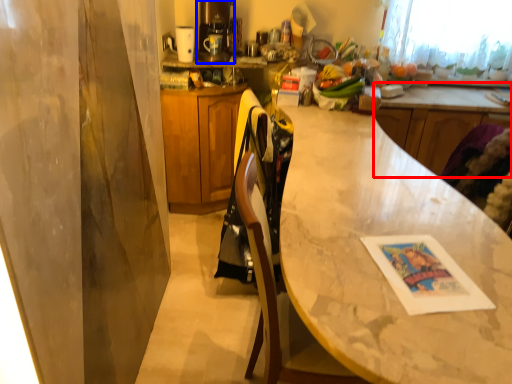
Question: Which of the following is the farthest to the observer, counter (highlighted by a red box) or coffee machine (highlighted by a blue box)?

Choices:
 (A) counter
 (B) coffee machine

Answer: (A)